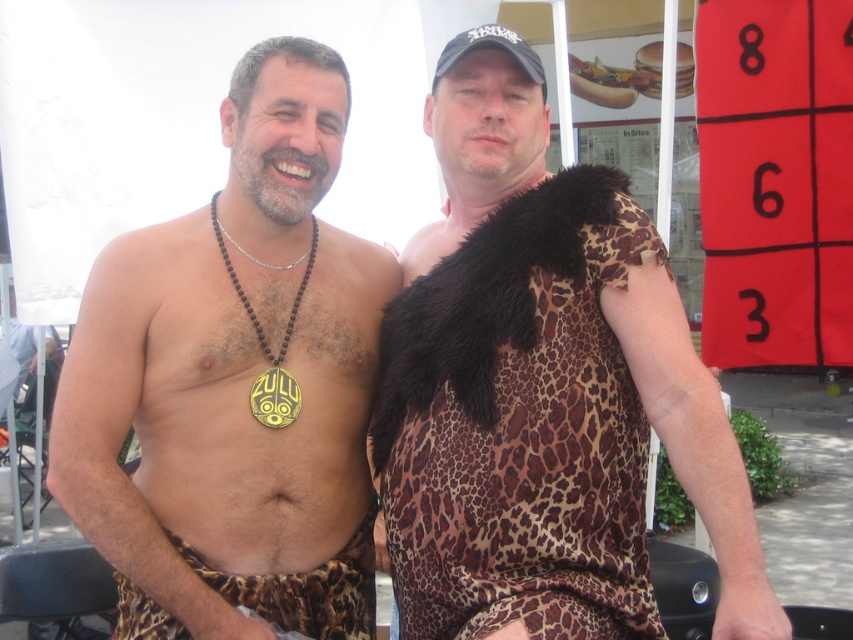
Question: Which object is closer to the camera taking this photo?

Choices:
 (A) leopard print fabric dress at upper right
 (B) leopard print loincloth at center

Answer: (A)

Question: Which of the following is the farthest from the observer?

Choices:
 (A) leopard print loincloth at center
 (B) leopard print fabric at lower center

Answer: (B)

Question: Can you confirm if leopard print fabric dress at upper right is positioned to the right of leopard print fabric at lower center?

Choices:
 (A) no
 (B) yes

Answer: (B)

Question: Can you confirm if leopard print loincloth at center is wider than leopard print fabric at lower center?

Choices:
 (A) no
 (B) yes

Answer: (B)

Question: Which of the following is the farthest from the observer?

Choices:
 (A) (381, 358)
 (B) (299, 497)
 (C) (300, 620)

Answer: (A)

Question: In this image, where is leopard print loincloth at center located relative to leopard print fabric at lower center?

Choices:
 (A) left
 (B) right

Answer: (B)